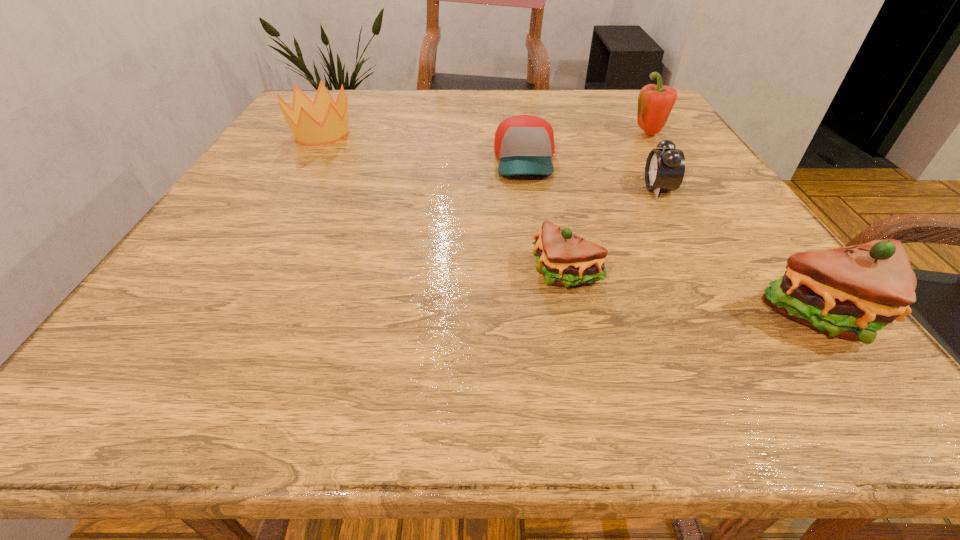
Find the location of a particular element. The width and height of the screenshot is (960, 540). the shorter sandwich is located at coordinates (565, 259).

This screenshot has width=960, height=540. I want to click on the right sandwich, so click(850, 292).

Find the location of a particular element. The width and height of the screenshot is (960, 540). pepper is located at coordinates (655, 102).

This screenshot has height=540, width=960. What are the coordinates of `baseball cap` in the screenshot? It's located at (524, 144).

You are a GUI agent. You are given a task and a screenshot of the screen. Output one action in this format:
    pyautogui.click(x=<x>, y=<y>)
    Task: Click on the alarm clock
    The image size is (960, 540).
    Given the screenshot: What is the action you would take?
    pyautogui.click(x=664, y=171)

At what (x,y) coordinates should I click in order to perform the action: click on the leftmost object. Please return your answer as a coordinate pair (x, y). The height and width of the screenshot is (540, 960). Looking at the image, I should click on (303, 119).

Find the location of a particular element. free point located on the left of the shorter sandwich is located at coordinates (454, 273).

Where is `vacant space located on the back of the taller sandwich`? vacant space located on the back of the taller sandwich is located at coordinates (775, 252).

Where is `vacant region located 0.070m on the back of the pepper`? vacant region located 0.070m on the back of the pepper is located at coordinates (636, 115).

Image resolution: width=960 pixels, height=540 pixels. I want to click on free space located 0.370m at the brim of the baseball cap, so coord(549,327).